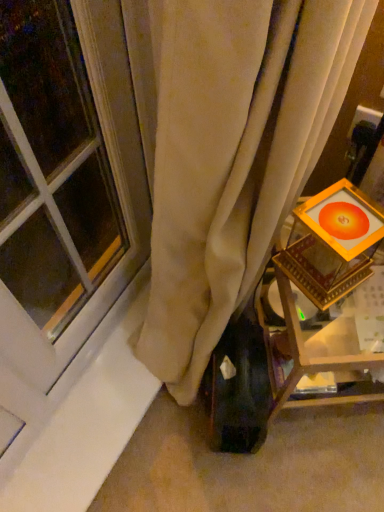
Question: Does matte glass window at left have a greater height compared to wooden framed picture at right?

Choices:
 (A) no
 (B) yes

Answer: (B)

Question: Is wooden framed picture at right surrounded by matte glass window at left?

Choices:
 (A) yes
 (B) no

Answer: (B)

Question: Considering the relative positions of matte glass window at left and wooden framed picture at right in the image provided, is matte glass window at left to the left of wooden framed picture at right from the viewer's perspective?

Choices:
 (A) yes
 (B) no

Answer: (A)

Question: From a real-world perspective, is matte glass window at left below wooden framed picture at right?

Choices:
 (A) yes
 (B) no

Answer: (B)

Question: Can you confirm if matte glass window at left is shorter than wooden framed picture at right?

Choices:
 (A) yes
 (B) no

Answer: (B)

Question: From the image's perspective, would you say matte glass window at left is positioned over wooden framed picture at right?

Choices:
 (A) yes
 (B) no

Answer: (A)

Question: Can you confirm if wooden framed picture at right is wider than matte glass window at left?

Choices:
 (A) yes
 (B) no

Answer: (A)

Question: From a real-world perspective, is wooden framed picture at right located higher than matte glass window at left?

Choices:
 (A) no
 (B) yes

Answer: (A)

Question: Does wooden framed picture at right lie in front of matte glass window at left?

Choices:
 (A) no
 (B) yes

Answer: (A)

Question: Does wooden framed picture at right have a larger size compared to matte glass window at left?

Choices:
 (A) yes
 (B) no

Answer: (A)

Question: Could you tell me if wooden framed picture at right is turned towards matte glass window at left?

Choices:
 (A) yes
 (B) no

Answer: (B)

Question: Is wooden framed picture at right far away from matte glass window at left?

Choices:
 (A) yes
 (B) no

Answer: (B)

Question: From the image's perspective, is wooden framed picture at right positioned above or below matte glass window at left?

Choices:
 (A) below
 (B) above

Answer: (A)